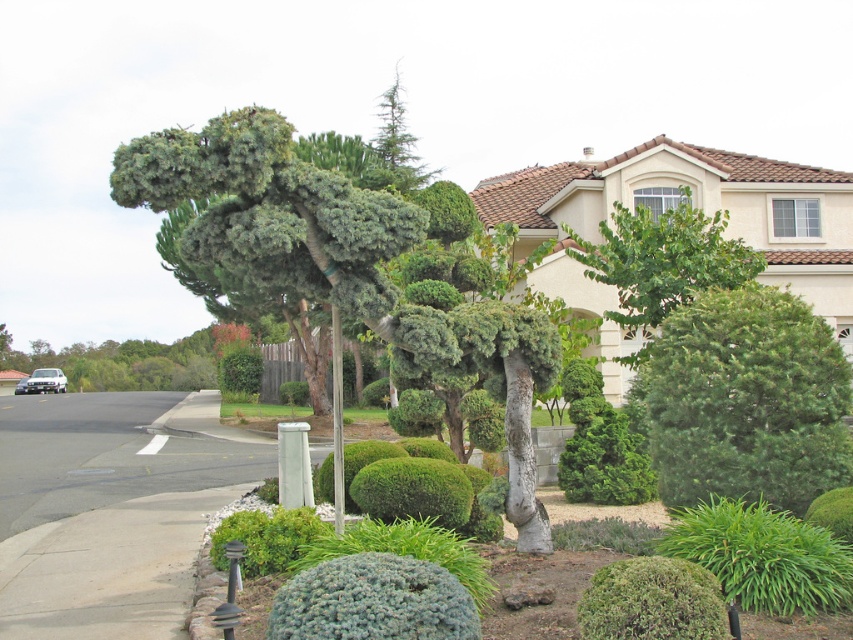
Question: Does green textured tree at center appear on the left side of green leafy tree at upper center?

Choices:
 (A) no
 (B) yes

Answer: (B)

Question: Which of these objects is positioned farthest from the green textured bush at center?

Choices:
 (A) green leafy shrub at lower right
 (B) blue textured shrub at lower center
 (C) green textured tree at center

Answer: (B)

Question: Can you confirm if green leafy shrub at lower right is wider than green textured bush at center?

Choices:
 (A) yes
 (B) no

Answer: (A)

Question: Is green leafy tree at upper center below green textured bush at center?

Choices:
 (A) no
 (B) yes

Answer: (A)

Question: Among these objects, which one is nearest to the camera?

Choices:
 (A) green textured bush at right
 (B) green leafy tree at upper center

Answer: (A)

Question: Estimate the real-world distances between objects in this image. Which object is closer to the green leafy tree at upper center?

Choices:
 (A) blue textured shrub at lower center
 (B) green textured bush at center

Answer: (B)